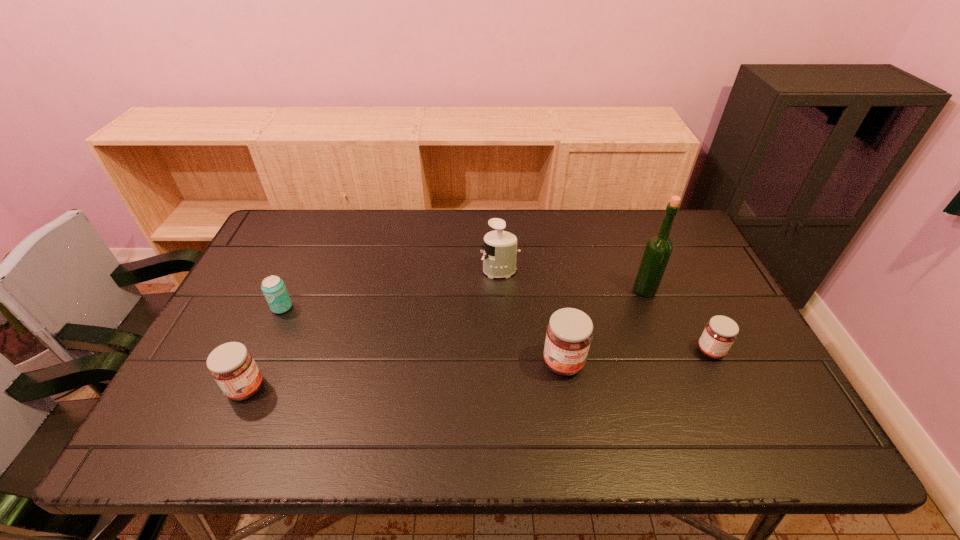
Find the location of a particular element. The width and height of the screenshot is (960, 540). the fourth object from right to left is located at coordinates (499, 257).

Find the location of `free region located on the right of the second tallest jam`. free region located on the right of the second tallest jam is located at coordinates (383, 388).

In order to click on free space located 0.380m on the left of the fourth shortest object in this screenshot , I will do `click(390, 363)`.

This screenshot has width=960, height=540. In order to click on vacant space located on the left of the rightmost jam in this screenshot , I will do `click(630, 351)`.

You are a GUI agent. You are given a task and a screenshot of the screen. Output one action in this format:
    pyautogui.click(x=<x>, y=<y>)
    Task: Click on the blank area located 0.310m on the right of the fourth nearest object
    This screenshot has height=540, width=960.
    Given the screenshot: What is the action you would take?
    pyautogui.click(x=402, y=307)

Identify the location of vacant space located 0.140m on the front of the second object from right to left. (662, 336).

Locate an element on the screen. This screenshot has height=540, width=960. vacant space located on the left of the second tallest object is located at coordinates 438,271.

The image size is (960, 540). In order to click on jam that is at the left edge in this screenshot , I will do `click(232, 366)`.

Where is `beer can that is at the left edge`? beer can that is at the left edge is located at coordinates (273, 287).

Where is `object located at the right edge`? The width and height of the screenshot is (960, 540). object located at the right edge is located at coordinates (x=720, y=332).